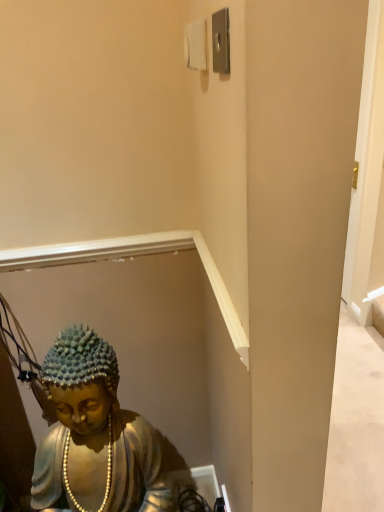
The image size is (384, 512). Describe the element at coordinates (95, 435) in the screenshot. I see `gold metallic statue at lower left` at that location.

This screenshot has width=384, height=512. I want to click on gold metallic statue at lower left, so click(x=95, y=435).

Locate an element on the screen. The image size is (384, 512). gold metallic statue at lower left is located at coordinates (95, 435).